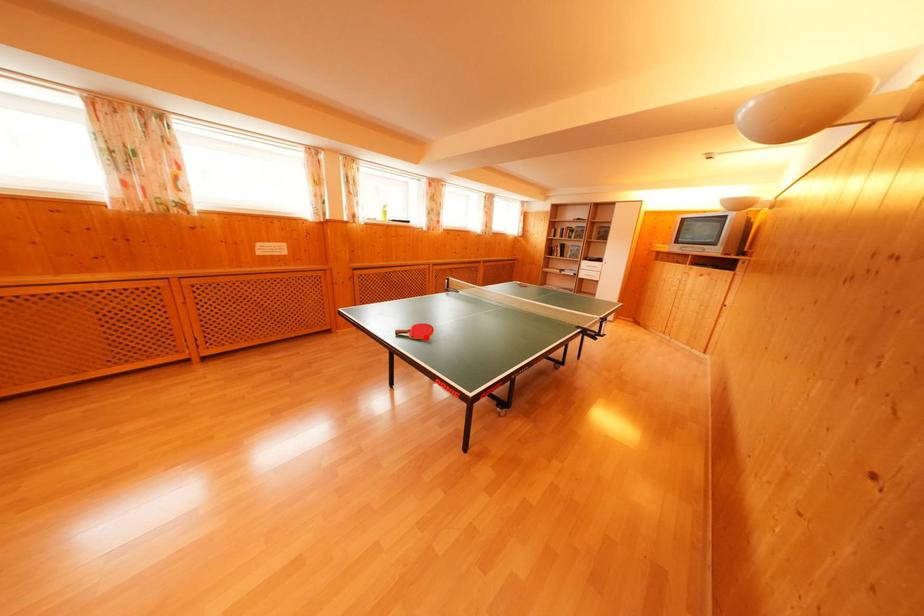
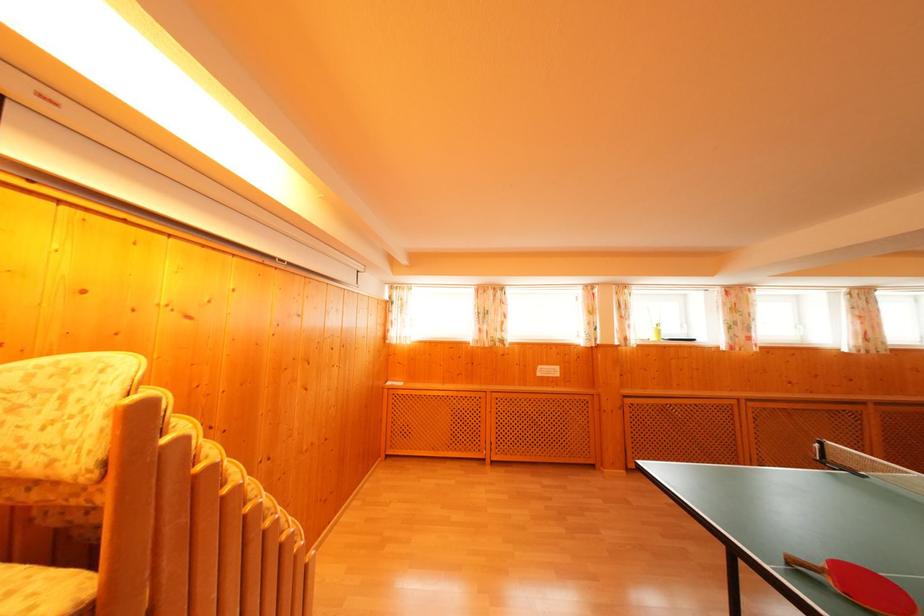
In the second image, find the point that corresponds to the highlighted location in the first image.

(870, 594)